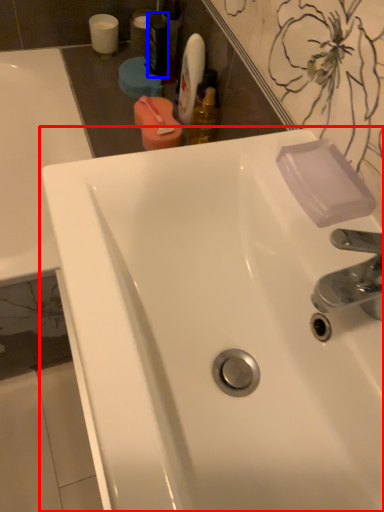
Question: Which object appears closest to the camera in this image, sink (highlighted by a red box) or mouthwash (highlighted by a blue box)?

Choices:
 (A) sink
 (B) mouthwash

Answer: (A)